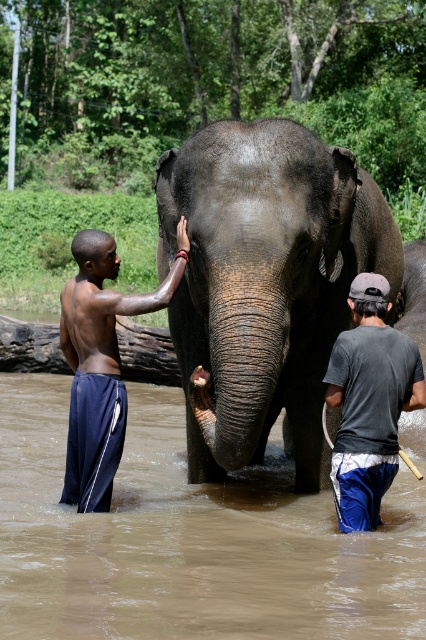
Measure the distance between dark gray textured elephant at center and dark blue shorts at left.

The distance of dark gray textured elephant at center from dark blue shorts at left is 38.97 inches.

Is point (178, 330) behind point (146, 308)?

Yes, it is.

Find the location of `dark gray textured elephant at center`. dark gray textured elephant at center is located at coordinates (264, 284).

Is point (270, 236) farther from camera compared to point (123, 368)?

That is False.

Which of these two, dark gray textured elephant at center or brown wood log at left, stands shorter?

Standing shorter between the two is brown wood log at left.

You are a GUI agent. You are given a task and a screenshot of the screen. Output one action in this format:
    pyautogui.click(x=<x>, y=<y>)
    Task: Click on the dark gray textured elephant at center
    This screenshot has width=426, height=640.
    Given the screenshot: What is the action you would take?
    pyautogui.click(x=264, y=284)

Is point (379, 280) positioned in front of point (123, 360)?

Yes, point (379, 280) is closer to viewer.

Does dark gray t-shirt at center have a smaller size compared to brown wood log at left?

Yes, dark gray t-shirt at center is smaller than brown wood log at left.

You are a GUI agent. You are given a task and a screenshot of the screen. Output one action in this format:
    pyautogui.click(x=<x>, y=<y>)
    Task: Click on the dark gray t-shirt at center
    
    Given the screenshot: What is the action you would take?
    pyautogui.click(x=368, y=403)

Find the location of a particular element. This screenshot has width=426, height=640. dark gray t-shirt at center is located at coordinates (368, 403).